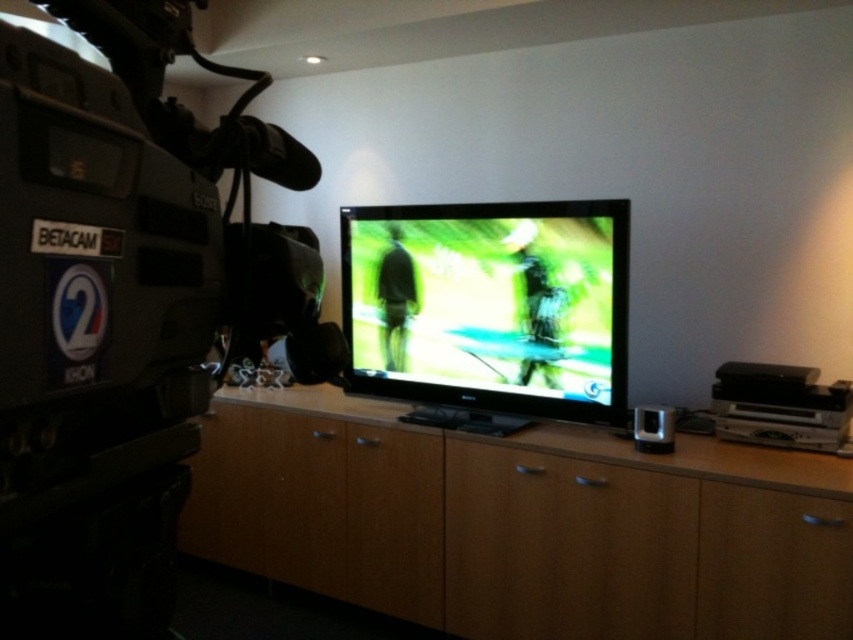
You are setting up a photography studio in the room. You have a light brown wood dresser at center and a green matte screen at center. Which object should you place on the side with more space considering their widths?

The light brown wood dresser at center has a larger width than the green matte screen at center, so you should place the object requiring more space on the side of the light brown wood dresser at center.

Consider the image. You are a technician in a studio and need to place a new monitor at point 0.8, 0.6. Is there enough space between the light brown wood dresser at center and the TV screen to place it there?

The light brown wood dresser at center is located at point [521,522], which is very close to the desired placement point of [511,512]. There may not be sufficient space to place the new monitor there without overlapping with the dresser.